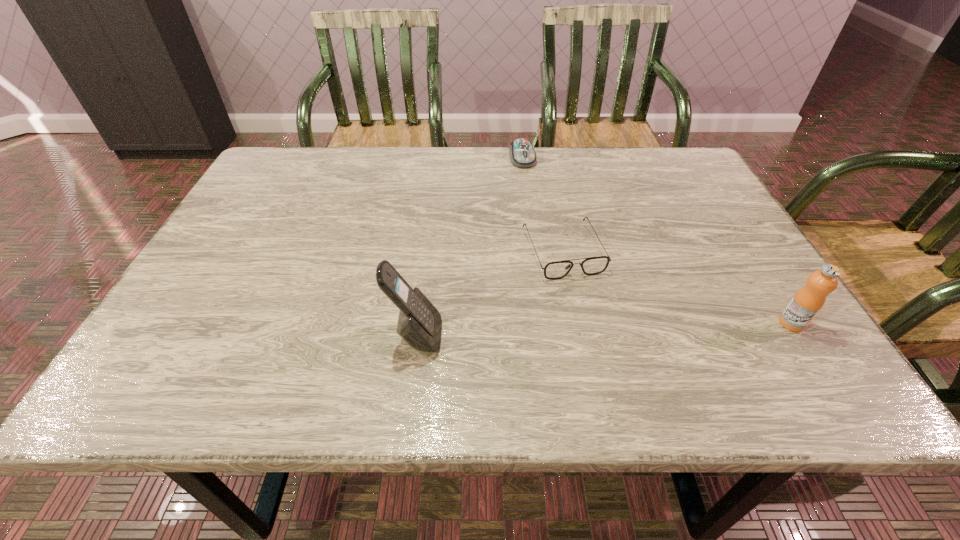
You are a GUI agent. You are given a task and a screenshot of the screen. Output one action in this format:
    pyautogui.click(x=<x>, y=<y>)
    Task: Click on the tallest object
    The width and height of the screenshot is (960, 540).
    Given the screenshot: What is the action you would take?
    pyautogui.click(x=419, y=324)

Identify the location of the leftmost object. Image resolution: width=960 pixels, height=540 pixels. (419, 324).

What are the coordinates of `orange juice` in the screenshot? It's located at (807, 302).

I want to click on the rightmost object, so click(x=807, y=302).

The height and width of the screenshot is (540, 960). I want to click on the shortest object, so click(522, 154).

Where is `the farthest object`? The height and width of the screenshot is (540, 960). the farthest object is located at coordinates (522, 154).

At what (x,y) coordinates should I click in order to perform the action: click on the third nearest object. Please return your answer as a coordinate pair (x, y). Looking at the image, I should click on (594, 265).

Find the location of a particular element. The image size is (960, 540). vacant space situated on the front-facing side of the cellular telephone is located at coordinates (580, 336).

In order to click on free space located 0.190m on the wheel side of the shortest object in this screenshot , I will do `click(540, 209)`.

The height and width of the screenshot is (540, 960). Identify the location of free space located on the wheel side of the shortest object. (542, 219).